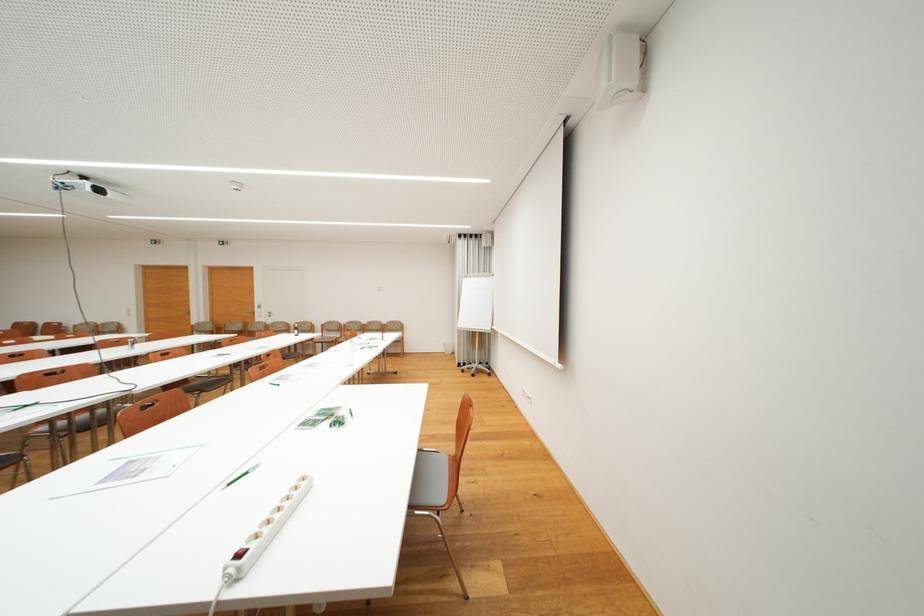
In order to click on red power switch in this screenshot , I will do `click(238, 553)`.